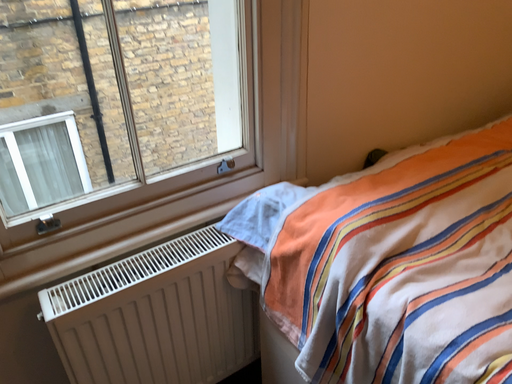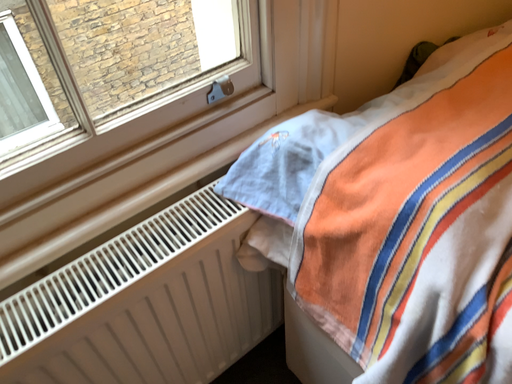
Question: Which way did the camera rotate in the video?

Choices:
 (A) rotated upward
 (B) rotated downward

Answer: (B)